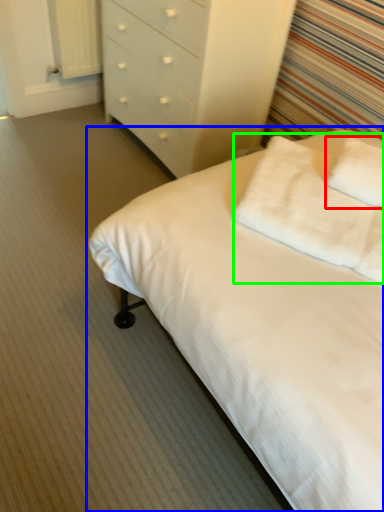
Question: Which object is positioned closest to pillow (highlighted by a red box)? Select from bed (highlighted by a blue box) and pillow (highlighted by a green box).

Choices:
 (A) bed
 (B) pillow

Answer: (B)